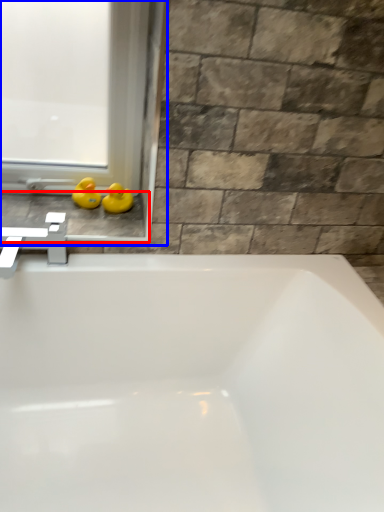
Question: Which point is further to the camera, window sill (highlighted by a red box) or window frame (highlighted by a blue box)?

Choices:
 (A) window sill
 (B) window frame

Answer: (A)